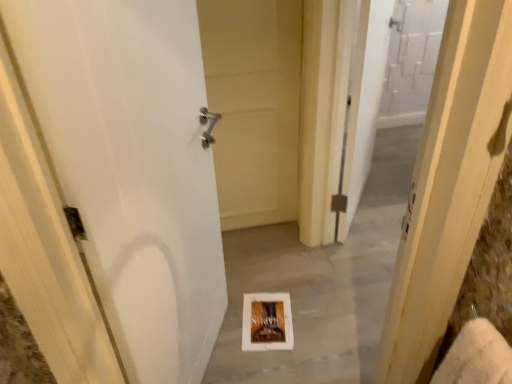
Find the location of `blank space situated above white paper at center (from a real-world perspective)`. blank space situated above white paper at center (from a real-world perspective) is located at coordinates (286, 314).